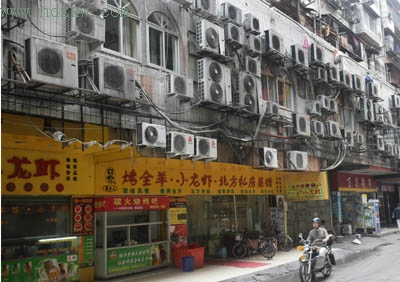
Where is `counter`? counter is located at coordinates (139, 239).